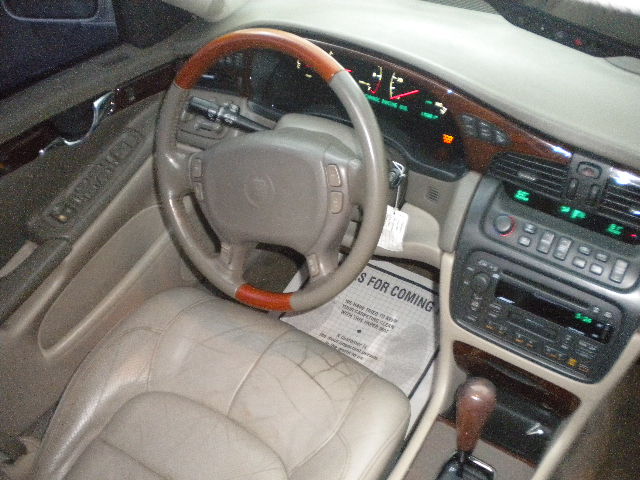
The width and height of the screenshot is (640, 480). Identify the location of paper floor mat. (385, 336).